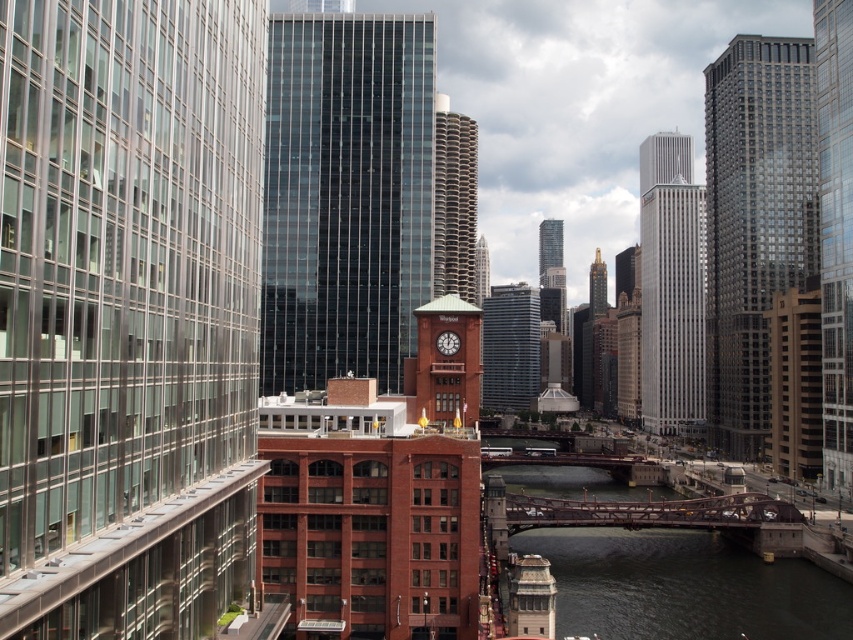
Question: Can you confirm if glassy steel skyscraper at center is smaller than glassy reflective skyscraper at right?

Choices:
 (A) yes
 (B) no

Answer: (A)

Question: Is the position of glassy steel skyscraper at left more distant than that of silver glass skyscraper at center?

Choices:
 (A) yes
 (B) no

Answer: (B)

Question: Is glassy steel skyscraper at center above glassy reflective skyscraper at right?

Choices:
 (A) yes
 (B) no

Answer: (A)

Question: Estimate the real-world distances between objects in this image. Which object is farther from the glassy reflective skyscraper at center?

Choices:
 (A) brown textured building at center
 (B) brick clock tower at center
 (C) glassy steel skyscraper at center
 (D) glassy steel skyscraper at left

Answer: (D)

Question: Which object is the farthest from the silver glass skyscraper at center?

Choices:
 (A) brick clock tower at center
 (B) dark gray concrete waterway at center
 (C) glassy reflective skyscraper at center

Answer: (A)

Question: Which point is closer to the camera?

Choices:
 (A) brick clock tower at center
 (B) brown textured building at center
 (C) glassy reflective skyscraper at center

Answer: (A)